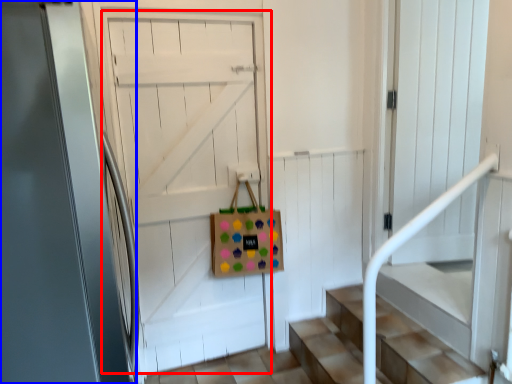
Question: Which object is closer to the camera taking this photo, door (highlighted by a red box) or door (highlighted by a blue box)?

Choices:
 (A) door
 (B) door

Answer: (B)